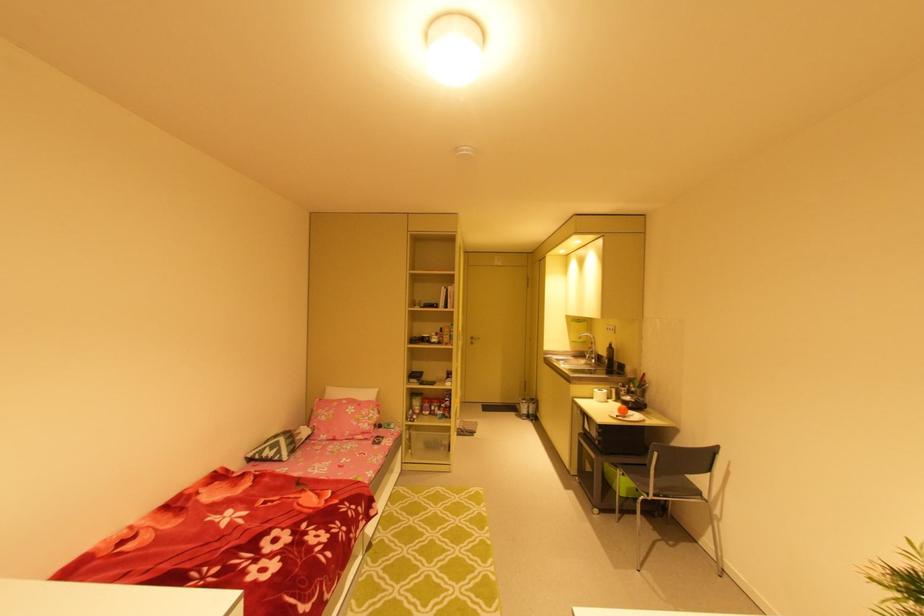
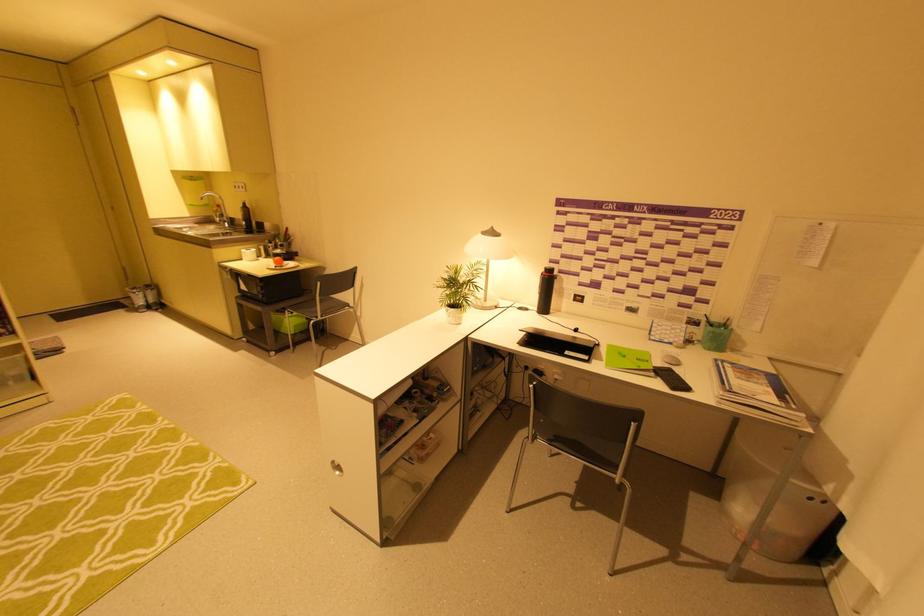
The point at (529, 406) is marked in the first image. Where is the corresponding point in the second image?

(142, 296)